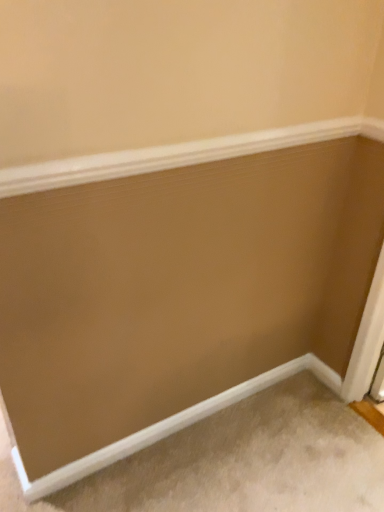
Locate an element on the screen. The height and width of the screenshot is (512, 384). matte white baseboard at lower center is located at coordinates (168, 426).

Measure the distance between point (84, 463) and camera.

A distance of 4.42 feet exists between point (84, 463) and camera.

This screenshot has height=512, width=384. Describe the element at coordinates (168, 426) in the screenshot. I see `matte white baseboard at lower center` at that location.

The width and height of the screenshot is (384, 512). What are the coordinates of `matte white baseboard at lower center` in the screenshot? It's located at (168, 426).